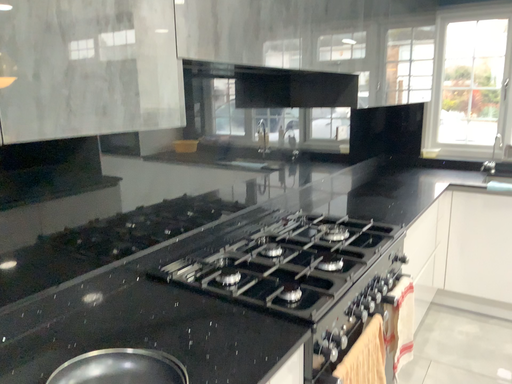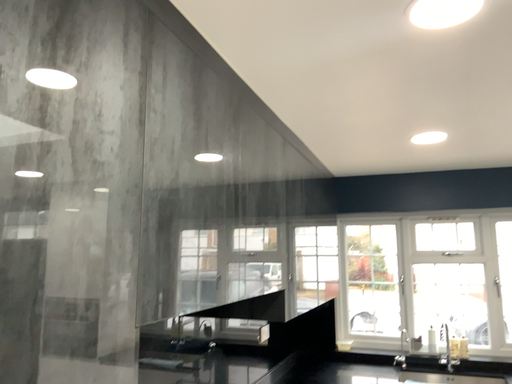
Question: How did the camera likely rotate when shooting the video?

Choices:
 (A) rotated right
 (B) rotated left

Answer: (A)